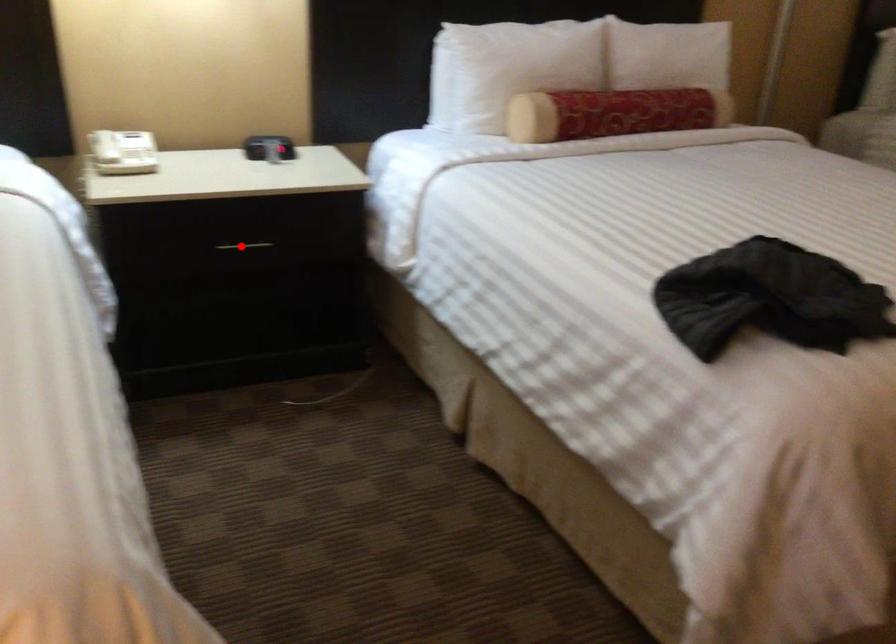
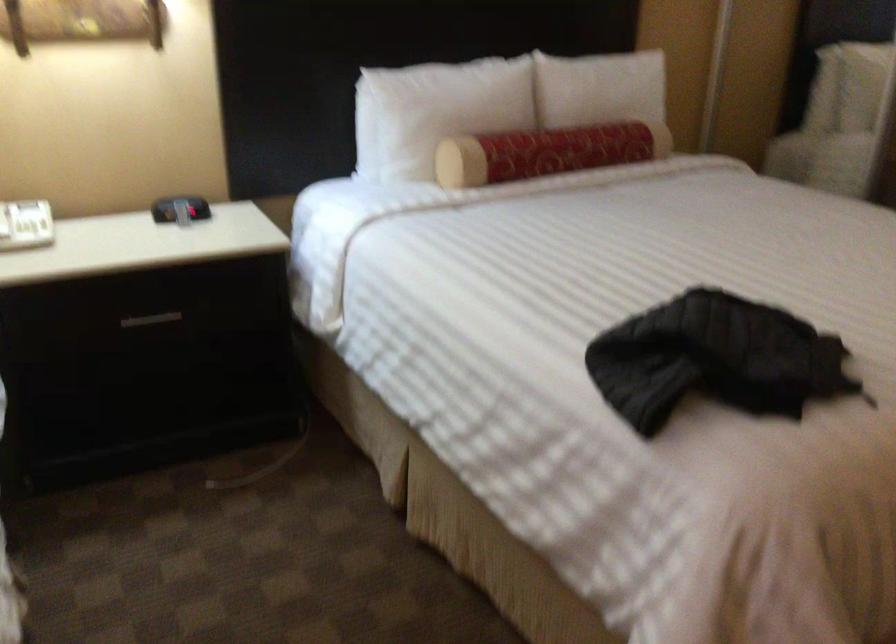
The point at the highlighted location is marked in the first image. Where is the corresponding point in the second image?

(151, 319)